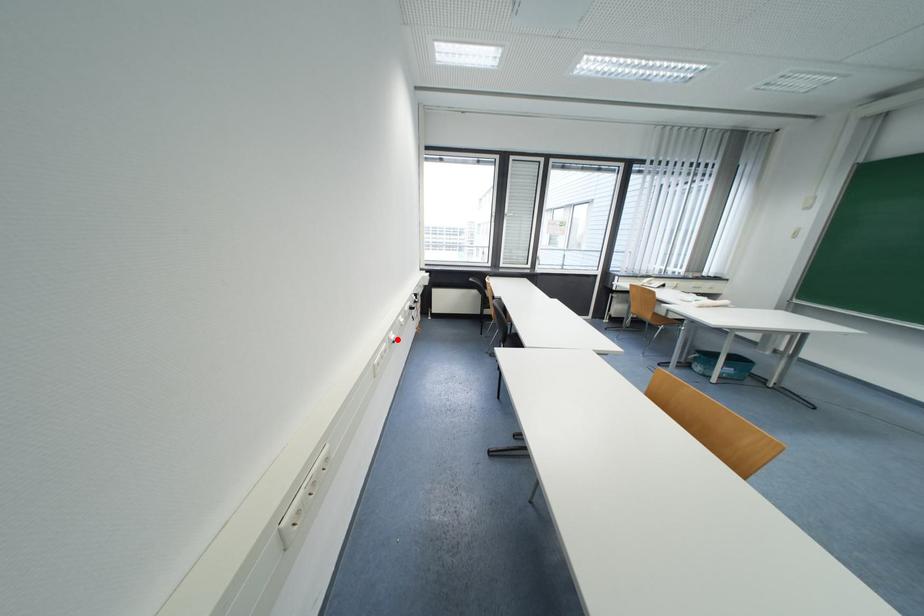
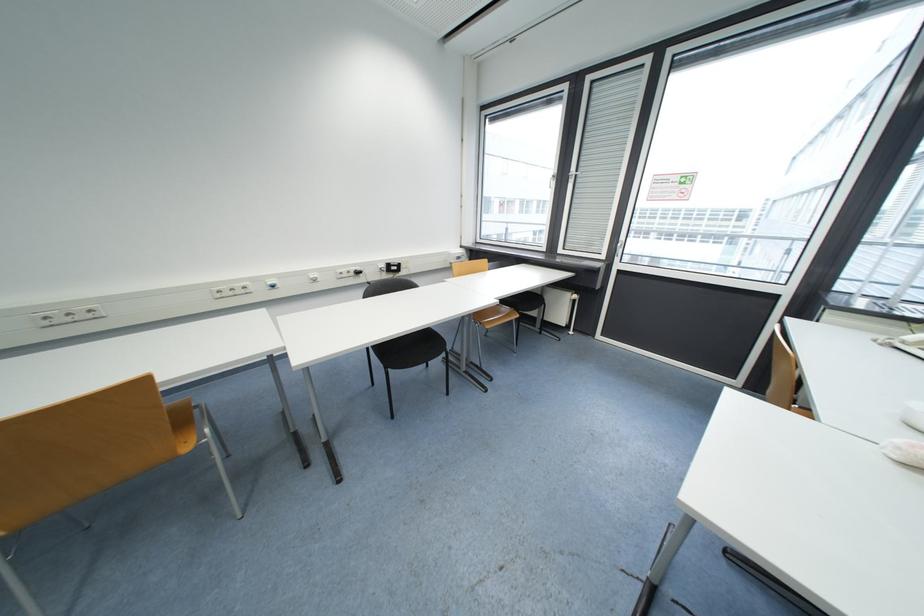
In the second image, find the point that corresponds to the highlighted location in the first image.

(274, 285)